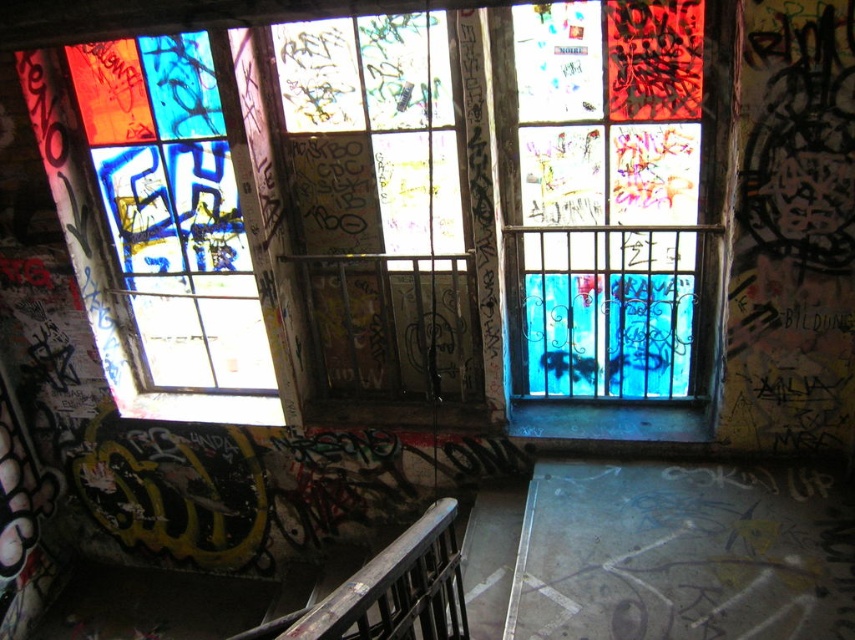
Question: Which of the following is the farthest from the observer?

Choices:
 (A) (667, 83)
 (B) (257, 317)
 (C) (440, 556)

Answer: (B)

Question: Can you confirm if stained glass window at upper left is positioned to the right of dark brown wooden balustrade at center?

Choices:
 (A) no
 (B) yes

Answer: (A)

Question: Among these points, which one is farthest from the camera?

Choices:
 (A) (575, 376)
 (B) (152, 298)

Answer: (B)

Question: Which object appears farthest from the camera in this image?

Choices:
 (A) translucent stained glass at center
 (B) stained glass window at upper left

Answer: (B)

Question: Is stained glass window at upper left to the right of dark brown wooden balustrade at center from the viewer's perspective?

Choices:
 (A) yes
 (B) no

Answer: (B)

Question: From the image, what is the correct spatial relationship of translucent stained glass at center in relation to dark brown wooden balustrade at center?

Choices:
 (A) below
 (B) above

Answer: (B)